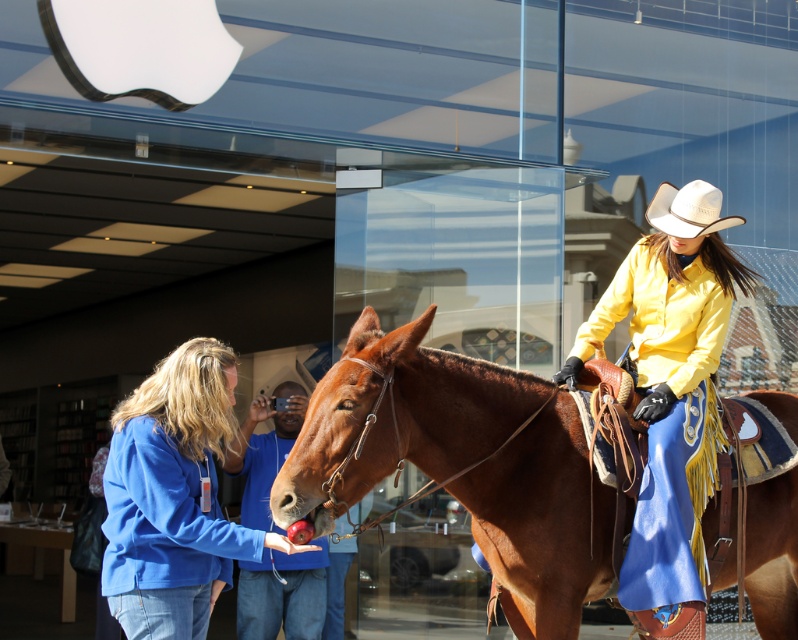
Question: Among these objects, which one is nearest to the camera?

Choices:
 (A) brown leather horse at center
 (B) blue cotton jacket at center
 (C) white felt cowboy hat at upper right

Answer: (B)

Question: Considering the relative positions of blue cotton jacket at center and white felt cowboy hat at upper right in the image provided, where is blue cotton jacket at center located with respect to white felt cowboy hat at upper right?

Choices:
 (A) above
 (B) below

Answer: (B)

Question: Does blue cotton jacket at center have a smaller size compared to white felt cowboy hat at upper right?

Choices:
 (A) no
 (B) yes

Answer: (A)

Question: Among these objects, which one is farthest from the camera?

Choices:
 (A) white felt cowboy hat at upper right
 (B) blue cotton jacket at center
 (C) brown leather horse at center

Answer: (A)

Question: Can you confirm if brown leather horse at center is wider than white felt cowboy hat at upper right?

Choices:
 (A) yes
 (B) no

Answer: (A)

Question: Which object is farther from the camera taking this photo?

Choices:
 (A) brown leather horse at center
 (B) white felt cowboy hat at upper right

Answer: (B)